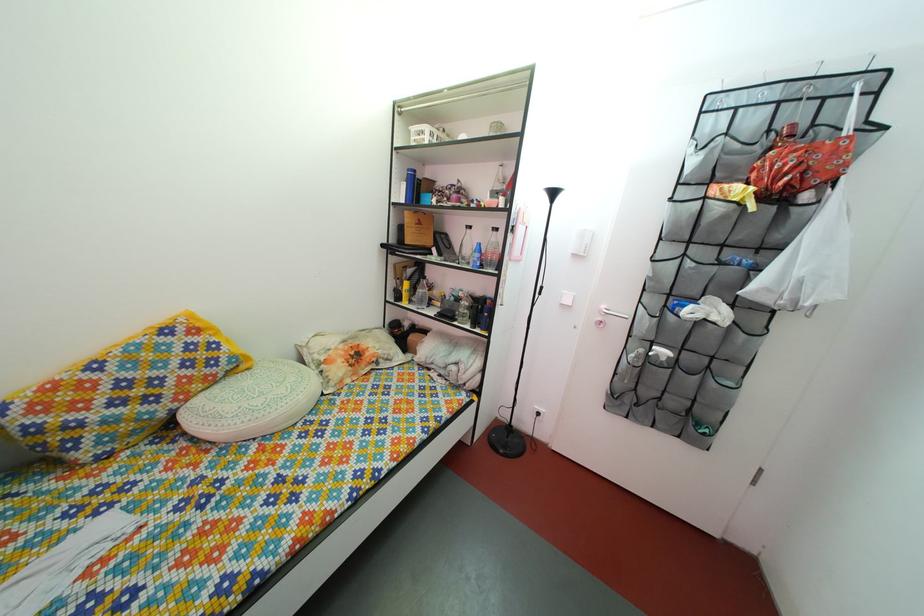
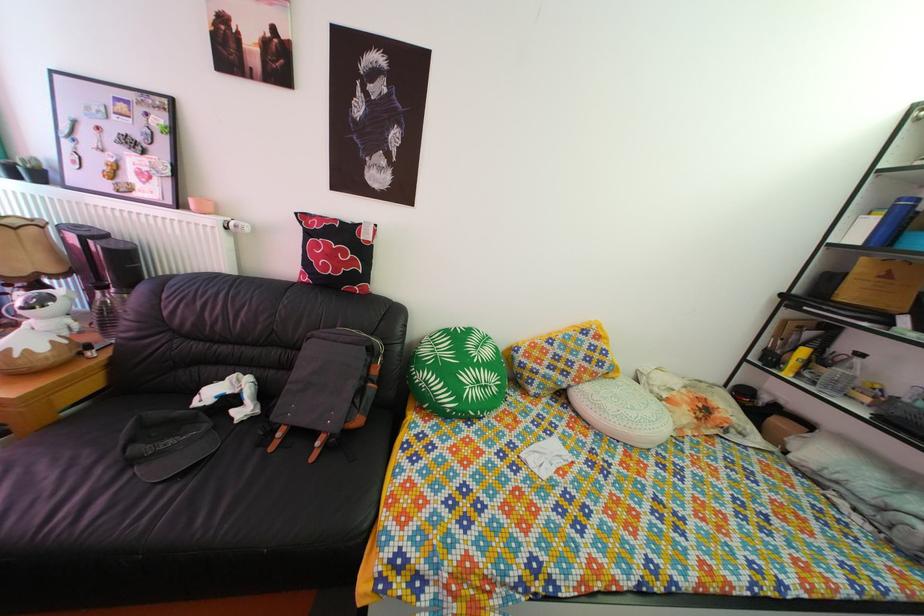
Question: The images are taken continuously from a first-person perspective. In which direction is your viewpoint rotating?

Choices:
 (A) Left
 (B) Right
 (C) Up
 (D) Down

Answer: (A)